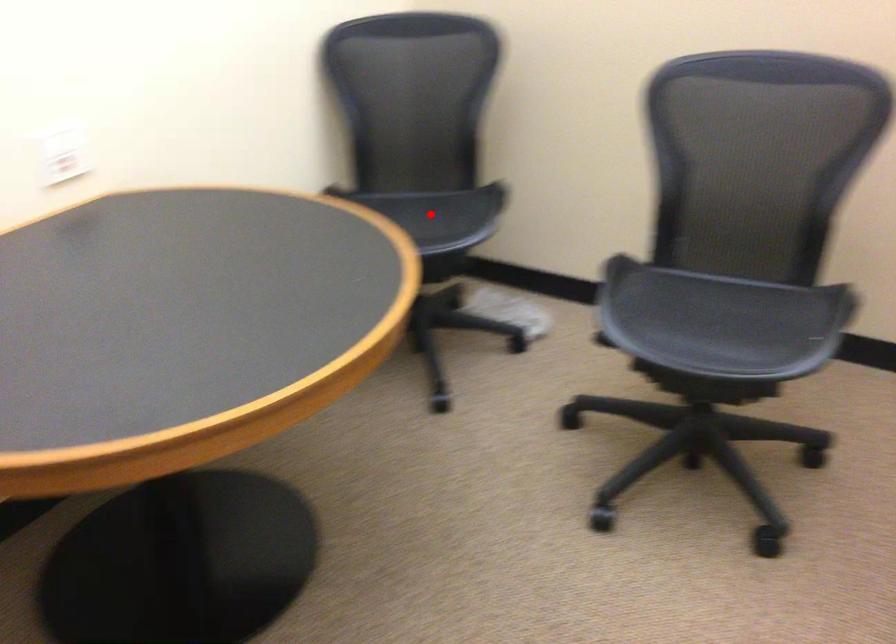
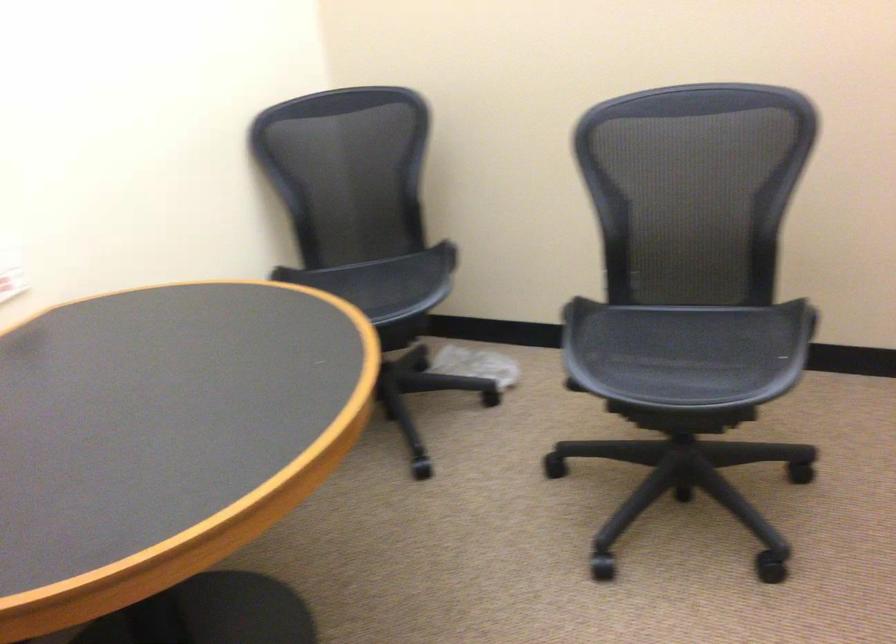
Find the pixel in the second image that matches the highlighted location in the first image.

(384, 281)